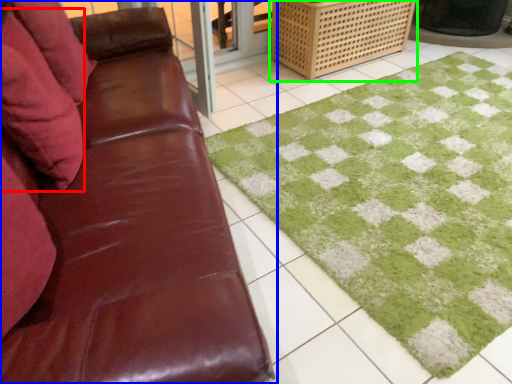
Question: Which object is positioned farthest from pillow (highlighted by a red box)? Select from studio couch (highlighted by a blue box) and crate (highlighted by a green box).

Choices:
 (A) studio couch
 (B) crate

Answer: (B)